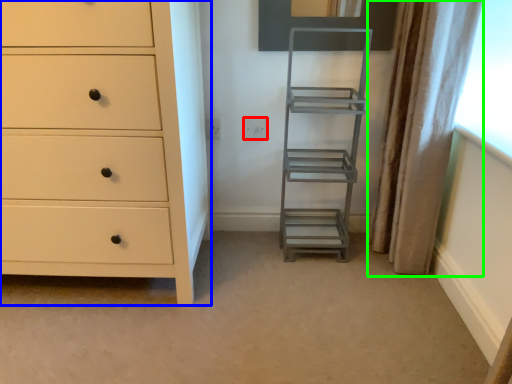
Question: Based on their relative distances, which object is farther from electric outlet (highlighted by a red box)? Choose from chest of drawers (highlighted by a blue box) and curtain (highlighted by a green box).

Choices:
 (A) chest of drawers
 (B) curtain

Answer: (A)